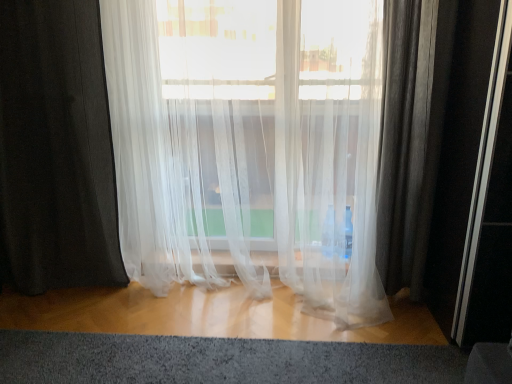
Question: In the image, is black sheer curtain at left, the second curtain when ordered from right to left, positioned in front of or behind textured gray carpet at lower center?

Choices:
 (A) behind
 (B) front

Answer: (A)

Question: From a real-world perspective, relative to textured gray carpet at lower center, is black sheer curtain at left, the second curtain when ordered from right to left, vertically above or below?

Choices:
 (A) below
 (B) above

Answer: (B)

Question: Considering the real-world distances, which object is closest to the textured gray carpet at lower center?

Choices:
 (A) translucent white curtain at center, which is the 2th curtain from left to right
 (B) black sheer curtain at left, the second curtain when ordered from right to left

Answer: (A)

Question: Considering the real-world distances, which object is closest to the black sheer curtain at left, the 1th curtain viewed from the left?

Choices:
 (A) translucent white curtain at center, the 1th curtain when ordered from right to left
 (B) textured gray carpet at lower center

Answer: (A)